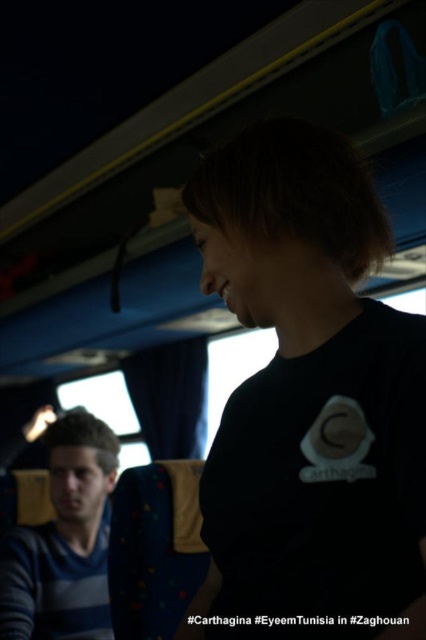
Question: Does black matte shirt at center have a greater width compared to blue striped shirt at lower left?

Choices:
 (A) yes
 (B) no

Answer: (A)

Question: Considering the relative positions of black matte shirt at center and blue striped shirt at lower left in the image provided, where is black matte shirt at center located with respect to blue striped shirt at lower left?

Choices:
 (A) below
 (B) above

Answer: (B)

Question: Can you confirm if black matte shirt at center is thinner than blue striped shirt at lower left?

Choices:
 (A) no
 (B) yes

Answer: (A)

Question: Which point is farther from the camera taking this photo?

Choices:
 (A) (241, 173)
 (B) (17, 545)

Answer: (B)